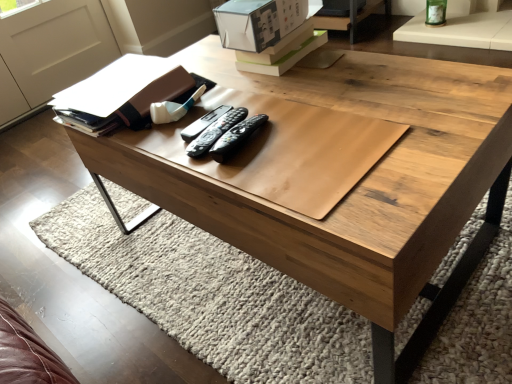
Locate an element on the screen. The height and width of the screenshot is (384, 512). vacant region to the right of black plastic remote at center, which ranks as the third remote in right-to-left order is located at coordinates (291, 111).